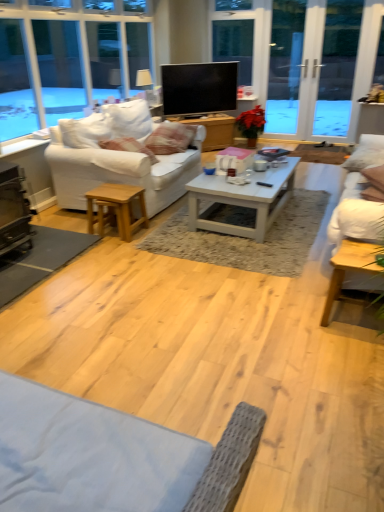
Identify the location of vacant space behind light brown wooden coffee table at center, the 2th coffee table in the back-to-front sequence. The height and width of the screenshot is (512, 384). point(311,289).